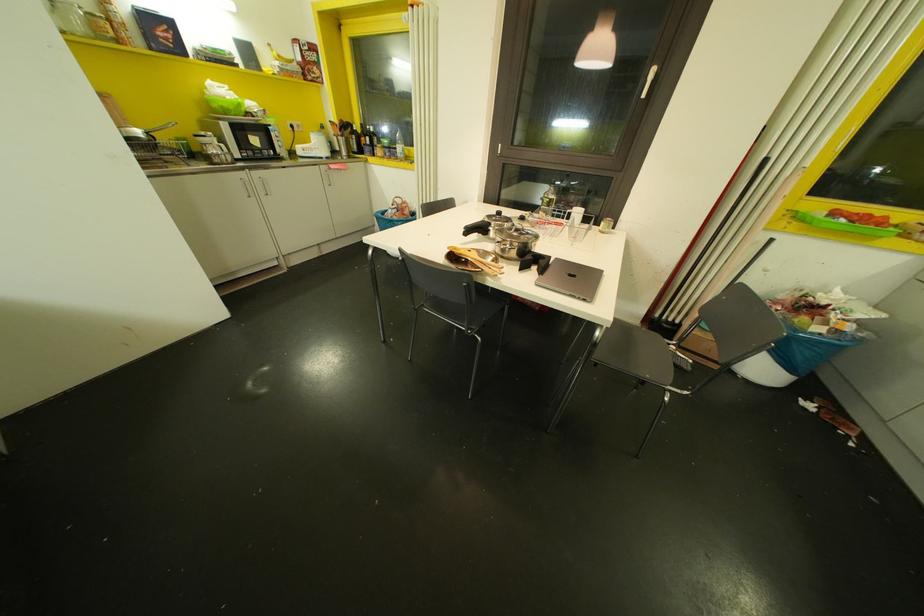
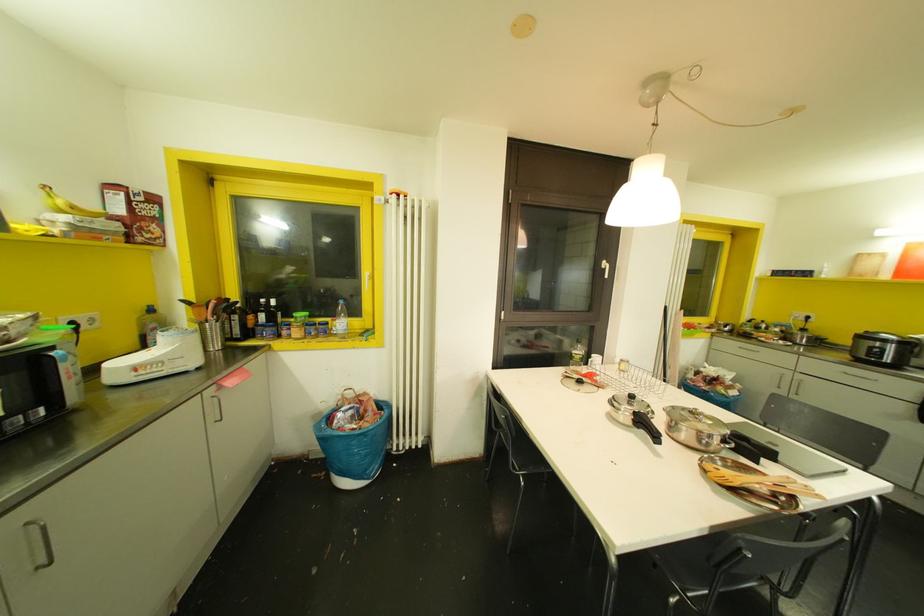
Where in the second image is the point corresponding to [641,95] from the first image?

(605, 276)